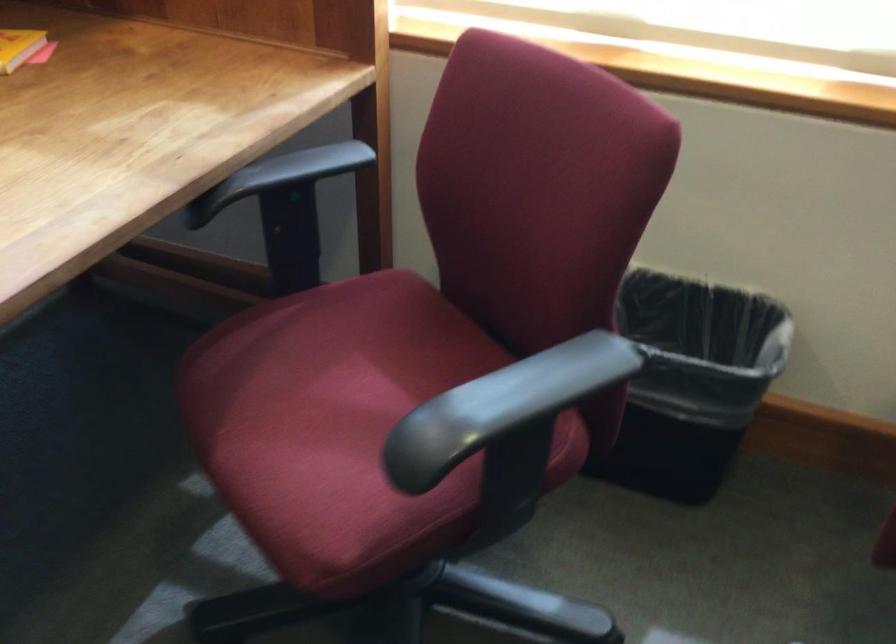
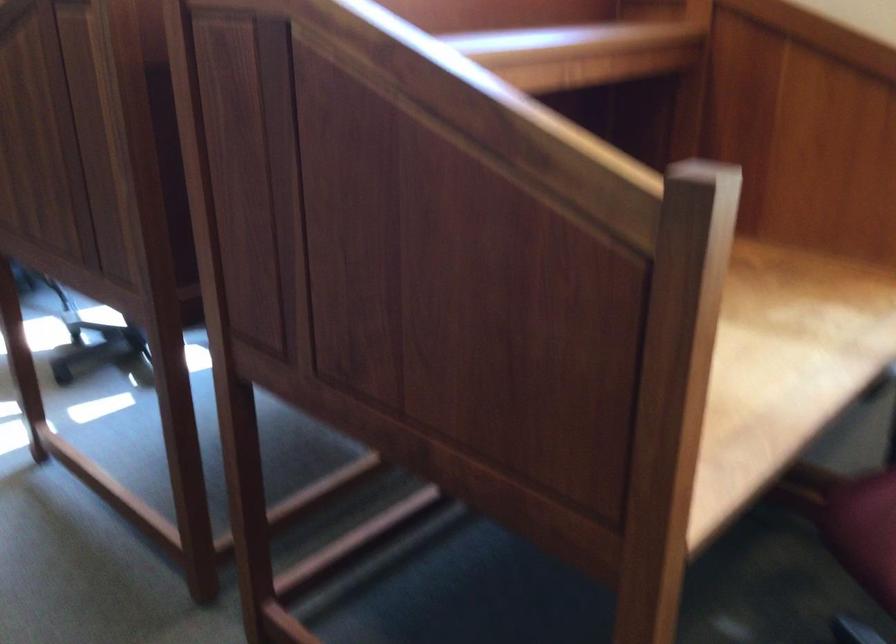
Question: Based on the continuous images, in which direction is the camera rotating? Reply with the corresponding letter.

Choices:
 (A) Left
 (B) Right
 (C) Up
 (D) Down

Answer: (A)